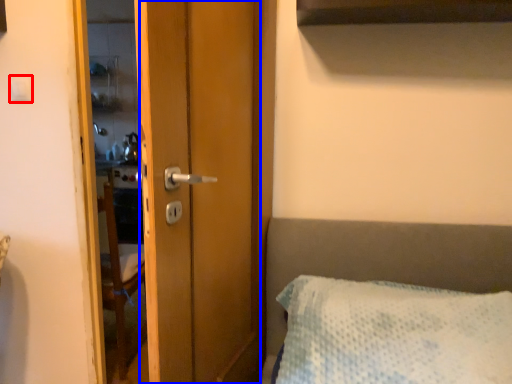
Question: Among these objects, which one is nearest to the camera, light switch (highlighted by a red box) or screen door (highlighted by a blue box)?

Choices:
 (A) light switch
 (B) screen door

Answer: (B)